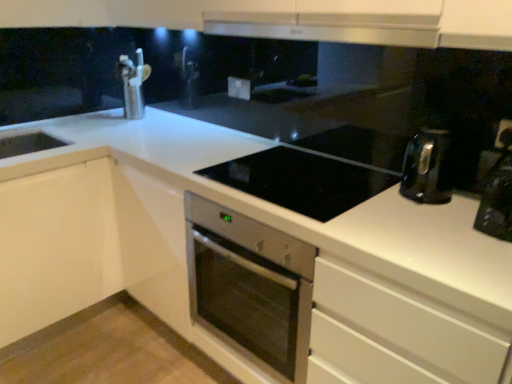
The height and width of the screenshot is (384, 512). Identify the location of vacant space that is to the left of black glossy coffee machine at right. (430, 229).